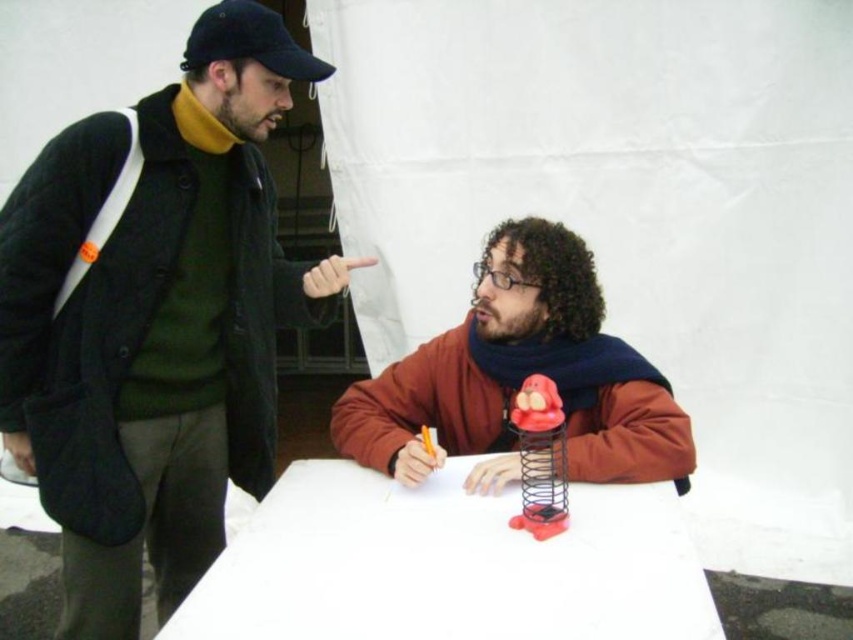
Does matte black jacket at left appear on the right side of white paper at center?

Incorrect, matte black jacket at left is not on the right side of white paper at center.

Between point (0, 381) and point (456, 570), which one is positioned in front?

Point (456, 570) is in front.

The height and width of the screenshot is (640, 853). Describe the element at coordinates (155, 321) in the screenshot. I see `matte black jacket at left` at that location.

Find the location of a particular element. Image resolution: width=853 pixels, height=640 pixels. matte black jacket at left is located at coordinates (155, 321).

Is matte black jacket at left to the left of matte orange jacket at center from the viewer's perspective?

Yes, matte black jacket at left is to the left of matte orange jacket at center.

Does matte black jacket at left appear over matte orange jacket at center?

Actually, matte black jacket at left is below matte orange jacket at center.

Where is `matte black jacket at left`? This screenshot has width=853, height=640. matte black jacket at left is located at coordinates (155, 321).

Based on the photo, which is below, matte black jacket at left or rubberized plastic spring at center?

rubberized plastic spring at center is below.

Who is more forward, (206, 26) or (526, 500)?

Positioned in front is point (526, 500).

Find the location of `matte black jacket at left`. matte black jacket at left is located at coordinates pyautogui.click(x=155, y=321).